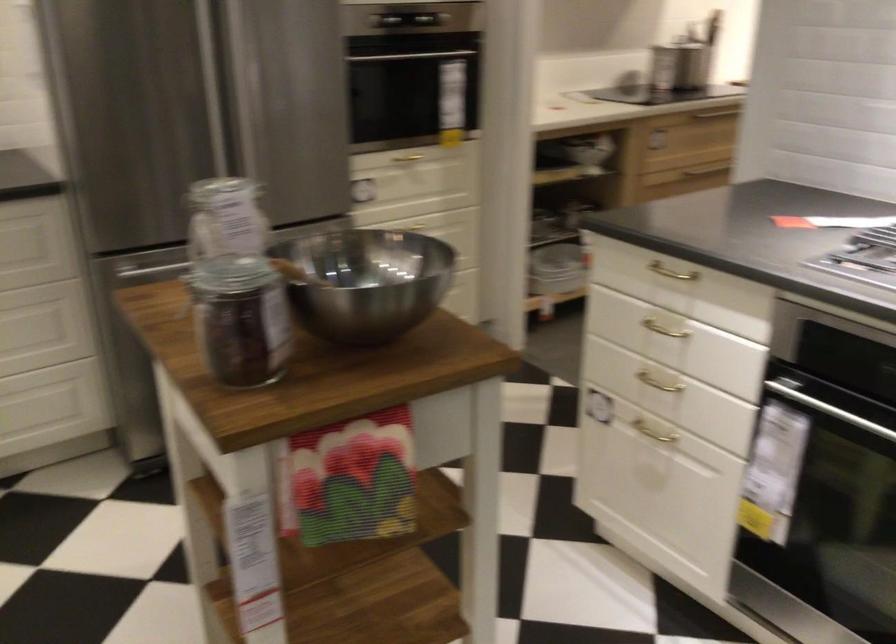
Locate an element on the screen. This screenshot has height=644, width=896. refrigerator handle is located at coordinates (410, 55).